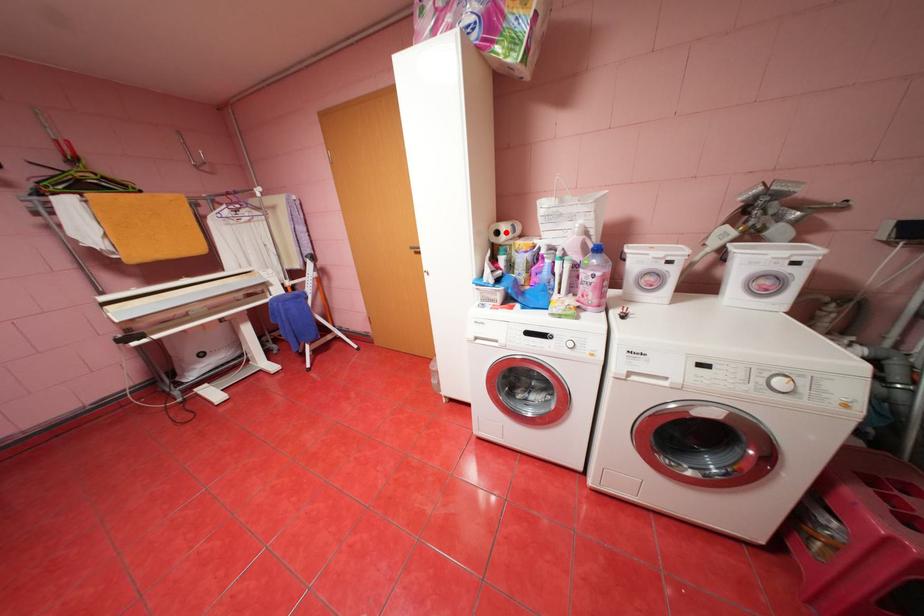
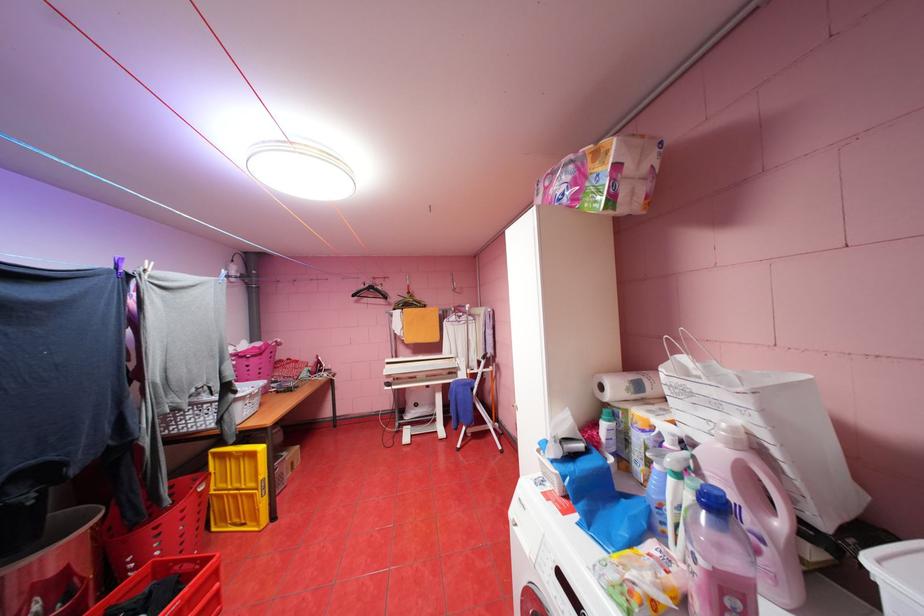
Question: I am providing you with two images of the same scene from different viewpoints. Given a red point in image1, look at the same physical point in image2. Is it:

Choices:
 (A) Closer to the viewpoint
 (B) Farther from the viewpoint

Answer: (B)